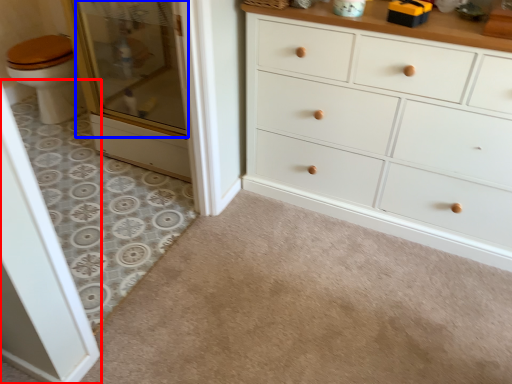
Question: Which object is closer to the camera taking this photo, screen door (highlighted by a red box) or screen door (highlighted by a blue box)?

Choices:
 (A) screen door
 (B) screen door

Answer: (A)